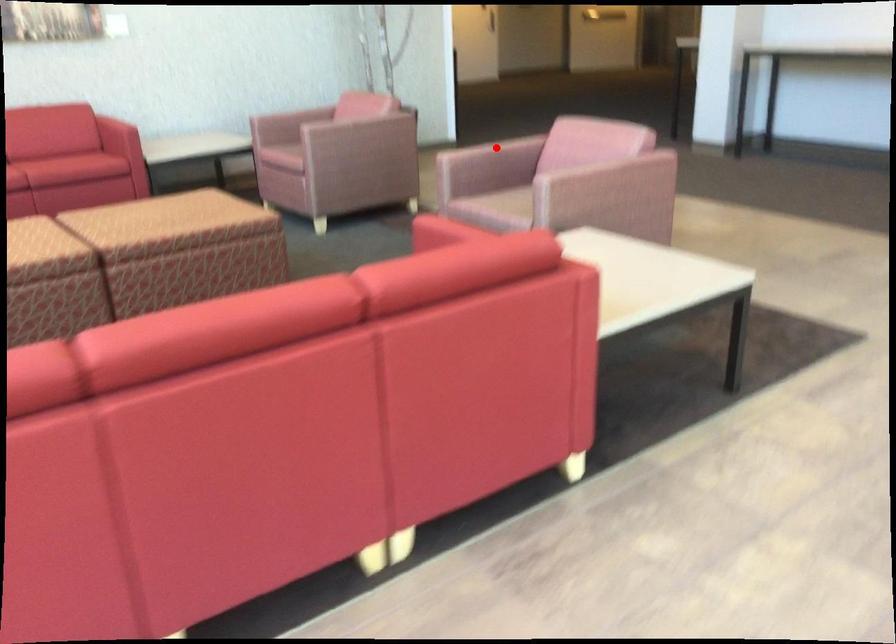
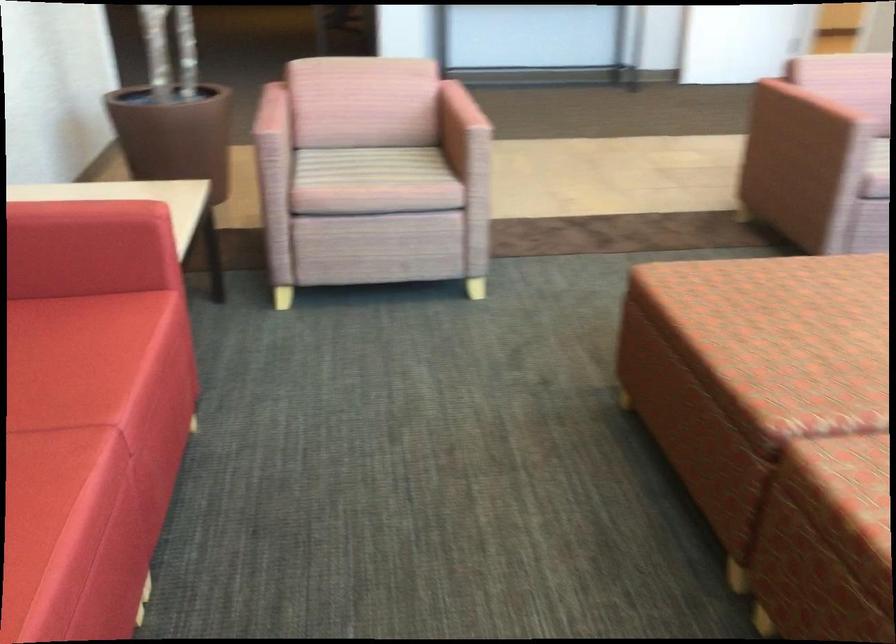
Question: I am providing you with two images of the same scene from different viewpoints. Image1 has a red point marked. In image2, the corresponding 3D location appears at what relative position? Reply with the corresponding letter.

Choices:
 (A) Closer
 (B) Farther

Answer: (A)